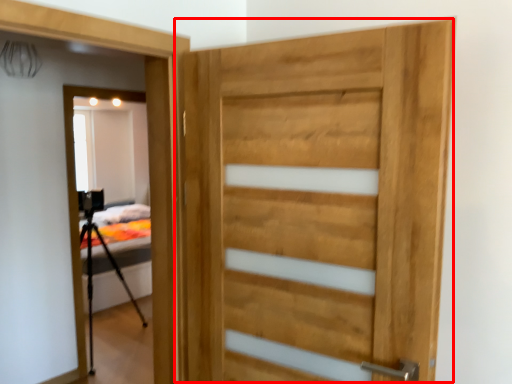
Question: Observing the image, what is the correct spatial positioning of door (annotated by the red box) in reference to tripod?

Choices:
 (A) right
 (B) left

Answer: (A)